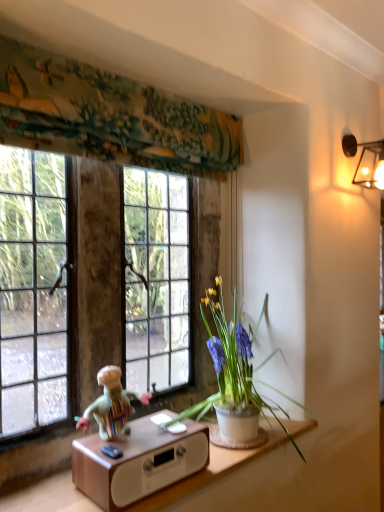
Question: Can we say multicolored fabric doll at lower center lies outside textured fabric at upper center?

Choices:
 (A) no
 (B) yes

Answer: (B)

Question: Does multicolored fabric doll at lower center have a lesser width compared to textured fabric at upper center?

Choices:
 (A) yes
 (B) no

Answer: (A)

Question: Does multicolored fabric doll at lower center contain textured fabric at upper center?

Choices:
 (A) yes
 (B) no

Answer: (B)

Question: Is multicolored fabric doll at lower center to the left of textured fabric at upper center from the viewer's perspective?

Choices:
 (A) no
 (B) yes

Answer: (B)

Question: Is multicolored fabric doll at lower center closer to the viewer compared to textured fabric at upper center?

Choices:
 (A) no
 (B) yes

Answer: (A)

Question: Is multicolored fabric doll at lower center oriented towards textured fabric at upper center?

Choices:
 (A) no
 (B) yes

Answer: (A)

Question: From a real-world perspective, is clear glass window at upper left beneath wooden table at lower center?

Choices:
 (A) no
 (B) yes

Answer: (A)

Question: Is clear glass window at upper left to the left of wooden table at lower center from the viewer's perspective?

Choices:
 (A) yes
 (B) no

Answer: (A)

Question: Can you confirm if clear glass window at upper left is bigger than wooden table at lower center?

Choices:
 (A) no
 (B) yes

Answer: (B)

Question: Is clear glass window at upper left completely or partially outside of wooden table at lower center?

Choices:
 (A) no
 (B) yes

Answer: (B)

Question: Does clear glass window at upper left lie behind wooden table at lower center?

Choices:
 (A) no
 (B) yes

Answer: (B)

Question: Is clear glass window at upper left smaller than wooden table at lower center?

Choices:
 (A) yes
 (B) no

Answer: (B)

Question: Considering the relative sizes of metallic wall sconce at upper right and textured fabric at upper center in the image provided, is metallic wall sconce at upper right smaller than textured fabric at upper center?

Choices:
 (A) yes
 (B) no

Answer: (A)